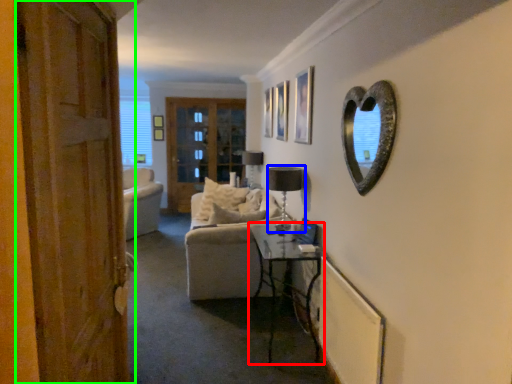
Question: Based on their relative distances, which object is nearer to table (highlighted by a red box)? Choose from lamp (highlighted by a blue box) and door (highlighted by a green box).

Choices:
 (A) lamp
 (B) door

Answer: (A)